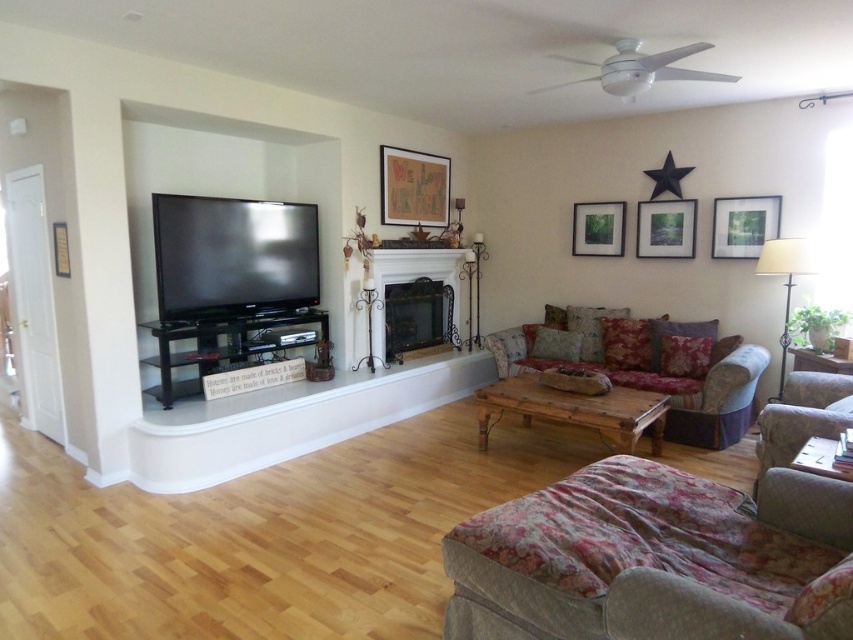
Does point (746, 544) come behind point (606, 236)?

No, it is not.

Is floral fabric ottoman at lower right below matte wooden picture frame at upper center?

Correct, floral fabric ottoman at lower right is located below matte wooden picture frame at upper center.

Where is `floral fabric ottoman at lower right`? This screenshot has height=640, width=853. floral fabric ottoman at lower right is located at coordinates (654, 560).

Identify the location of floral fabric ottoman at lower right. coord(654,560).

Is point (660, 380) positioned behind point (682, 212)?

That is False.

In the scene shown: Can you confirm if floral fabric couch at center is positioned above matte wooden picture frame at upper right?

Incorrect, floral fabric couch at center is not positioned above matte wooden picture frame at upper right.

This screenshot has height=640, width=853. What are the coordinates of `floral fabric couch at center` in the screenshot? It's located at (688, 378).

Looking at this image, who is taller, wooden framed map at upper center or matte white picture frame at upper right?

Standing taller between the two is wooden framed map at upper center.

Can you confirm if wooden framed map at upper center is positioned to the right of matte white picture frame at upper right?

In fact, wooden framed map at upper center is to the left of matte white picture frame at upper right.

Locate an element on the screen. wooden framed map at upper center is located at coordinates pos(413,188).